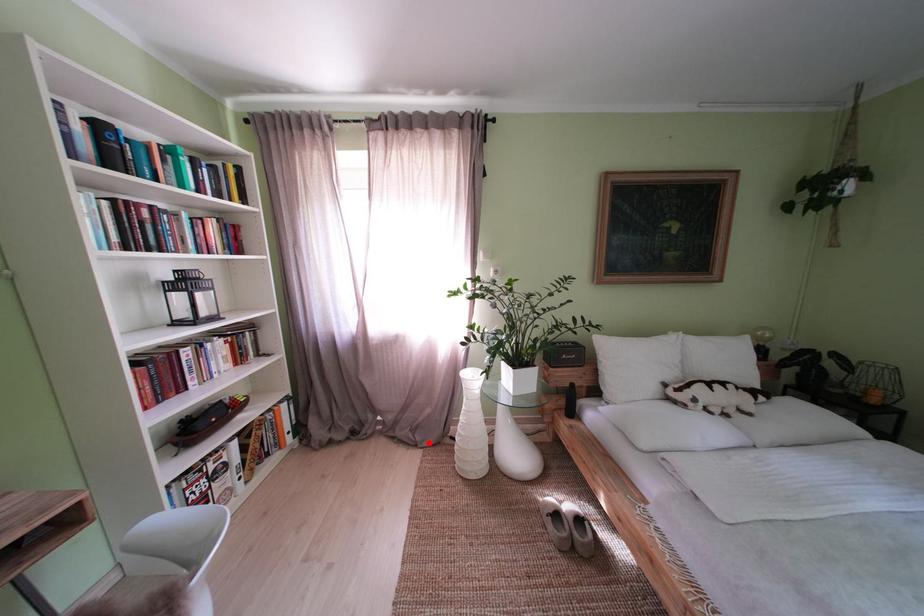
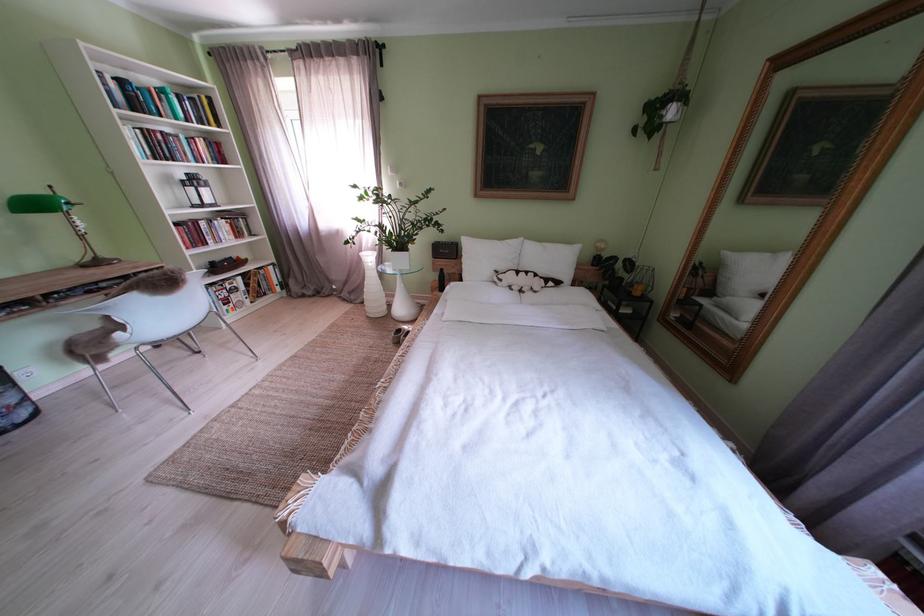
In the second image, find the point that corresponds to the highlighted location in the first image.

(363, 302)